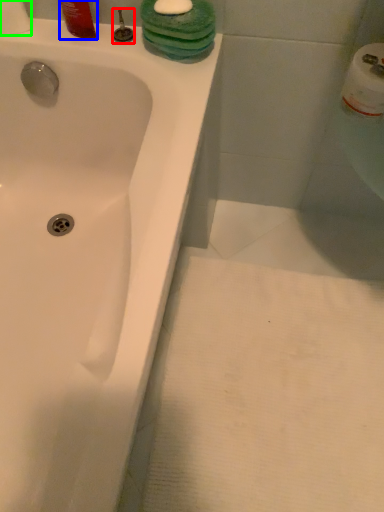
Question: Which object is the closest to the plumbing fixture (highlighted by a red box)? Choose among these: liquid (highlighted by a blue box) or toilet paper (highlighted by a green box).

Choices:
 (A) liquid
 (B) toilet paper

Answer: (A)